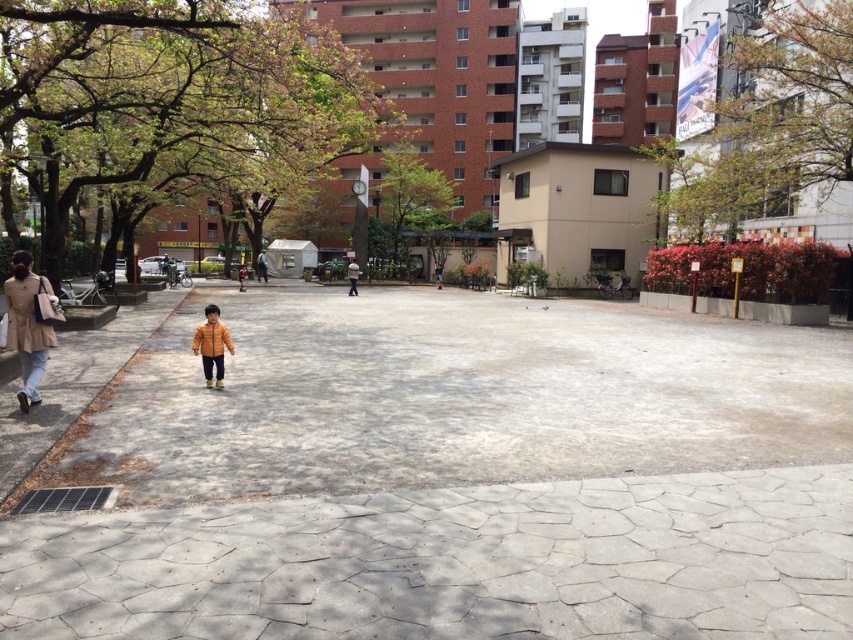
What do you see at coordinates (451, 396) in the screenshot? This screenshot has height=640, width=853. I see `gray concrete pavement at center` at bounding box center [451, 396].

Can you confirm if gray concrete pavement at center is shorter than beige fabric coat at left?

In fact, gray concrete pavement at center may be taller than beige fabric coat at left.

Between point (32, 419) and point (15, 252), which one is positioned in front?

Point (32, 419)

You are a GUI agent. You are given a task and a screenshot of the screen. Output one action in this format:
    pyautogui.click(x=<x>, y=<y>)
    Task: Click on the gray concrete pavement at center
    The width and height of the screenshot is (853, 640).
    Given the screenshot: What is the action you would take?
    (451, 396)

Is gray concrete pavement at center taller than yellow matte jacket at center?

Yes.

Does gray concrete pavement at center have a lesser height compared to yellow matte jacket at center?

No.

The height and width of the screenshot is (640, 853). Find the location of `gray concrete pavement at center`. gray concrete pavement at center is located at coordinates (451, 396).

Is point (16, 296) farther from viewer compared to point (212, 365)?

No, (16, 296) is in front of (212, 365).

Is point (50, 342) positioned after point (221, 353)?

No, (50, 342) is closer to viewer.

I want to click on beige fabric coat at left, so click(x=27, y=324).